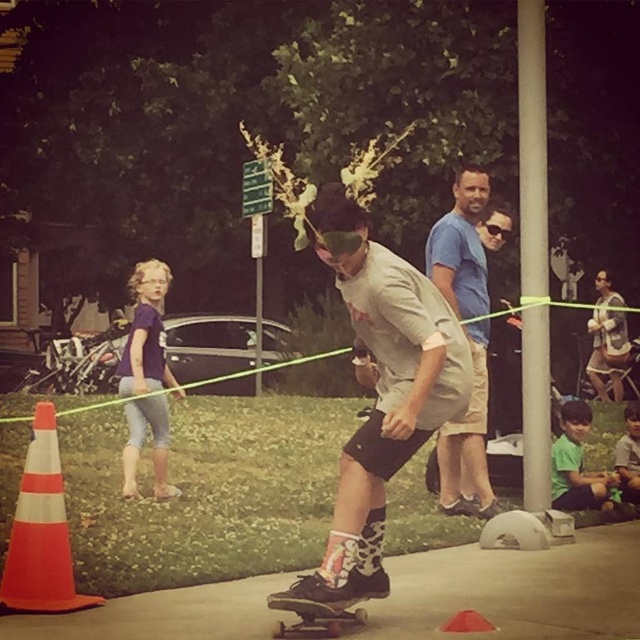
You are organizing a clothing drive and need to categorize the shirts based on their sizes. You see two shirts, the light gray cotton shirt at center and the light blue cotton shirt at center. Which shirt should you place in the large size bin?

The light gray cotton shirt at center should be placed in the large size bin because it is larger in size than the light blue cotton shirt at center.